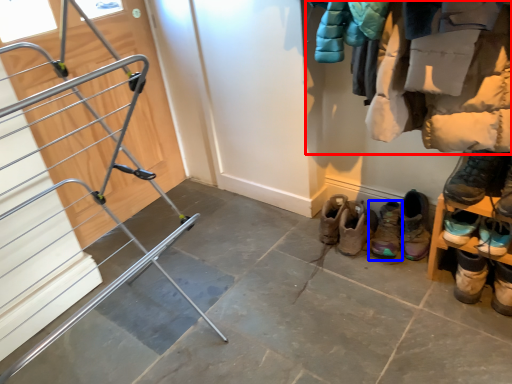
Question: Which object appears farthest to the camera in this image, closet (highlighted by a red box) or footwear (highlighted by a blue box)?

Choices:
 (A) closet
 (B) footwear

Answer: (B)